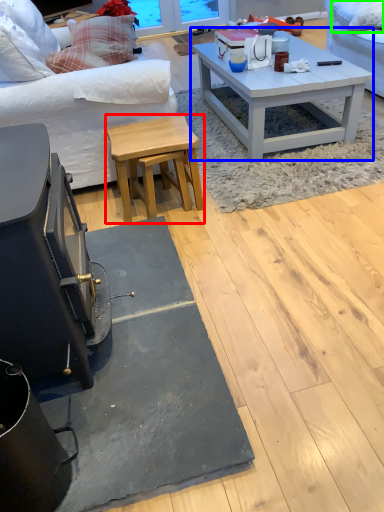
Question: Based on their relative distances, which object is farther from stool (highlighted by a red box)? Choose from coffee table (highlighted by a blue box) and pillow (highlighted by a green box).

Choices:
 (A) coffee table
 (B) pillow

Answer: (B)